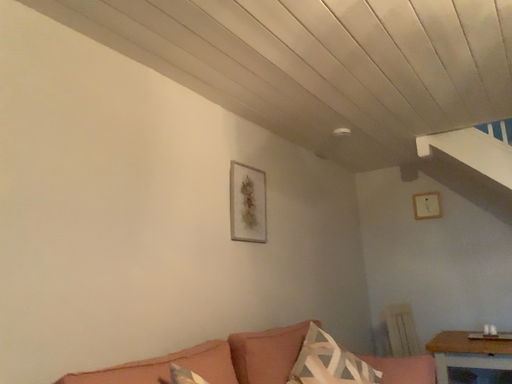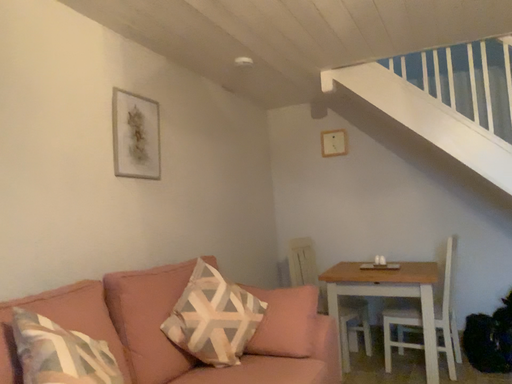
Question: Which way did the camera rotate in the video?

Choices:
 (A) rotated left
 (B) rotated right

Answer: (B)